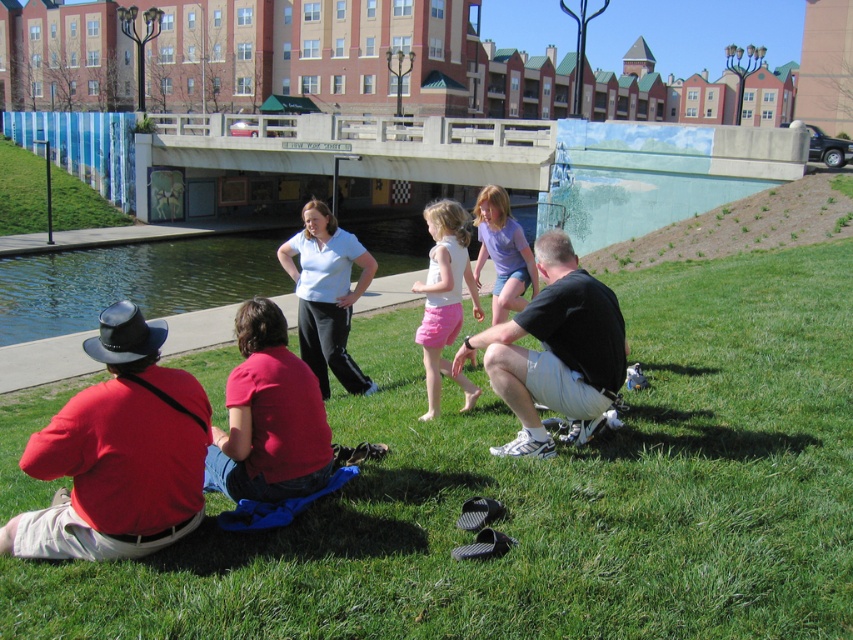
Question: In this image, where is black cotton shirt at lower right located relative to red cotton shirt at lower left?

Choices:
 (A) above
 (B) below

Answer: (A)

Question: Can you confirm if green grass at lower center is thinner than matte white tank top at center?

Choices:
 (A) yes
 (B) no

Answer: (B)

Question: Can you confirm if green grass at lower center is positioned to the left of red cotton shirt at lower left?

Choices:
 (A) no
 (B) yes

Answer: (A)

Question: Estimate the real-world distances between objects in this image. Which object is closer to the matte white tank top at center?

Choices:
 (A) matte red shirt at lower left
 (B) red cotton shirt at lower left

Answer: (B)

Question: Estimate the real-world distances between objects in this image. Which object is closer to the black cotton shirt at lower right?

Choices:
 (A) matte red shirt at lower left
 (B) red cotton shirt at lower left
 (C) matte white shirt at center

Answer: (B)

Question: Which of these objects is positioned closest to the red cotton shirt at lower left?

Choices:
 (A) matte red shirt at lower left
 (B) matte white tank top at center

Answer: (A)